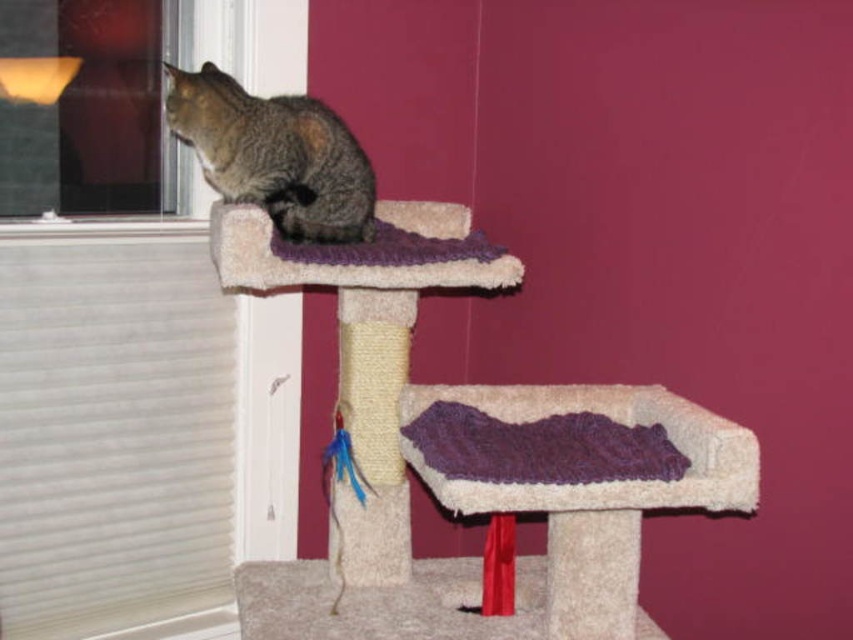
You are a small toy mouse that wants to roll from the beige carpeted stool at center to the tabby fur cat at left. Can you reach the cat without moving off the stool?

The beige carpeted stool at center is closer to the viewer than the tabby fur cat at left, so the mouse would have to roll away from the viewer to reach the cat, meaning it would leave the stool. Therefore, the mouse cannot reach the cat without moving off the stool.

You are a cat owner who wants to ensure your cat can see outside. Based on the scene, can the tabby fur cat at left see through the transparent glass window at upper left? Explain your reasoning.

The transparent glass window at upper left is taller than the tabby fur cat at left, so the cat can see through the transparent glass window at upper left since it is tall enough for the cat to look out of.